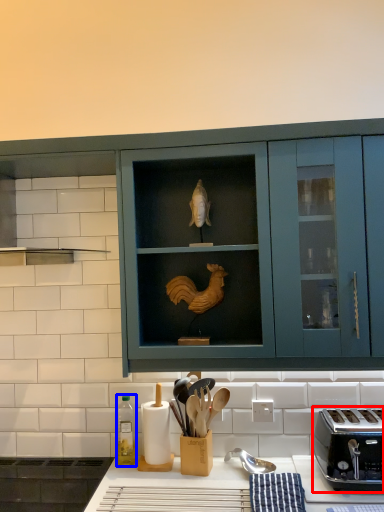
Question: Among these objects, which one is nearest to the camera, toaster (highlighted by a red box) or bottle (highlighted by a blue box)?

Choices:
 (A) toaster
 (B) bottle

Answer: (A)